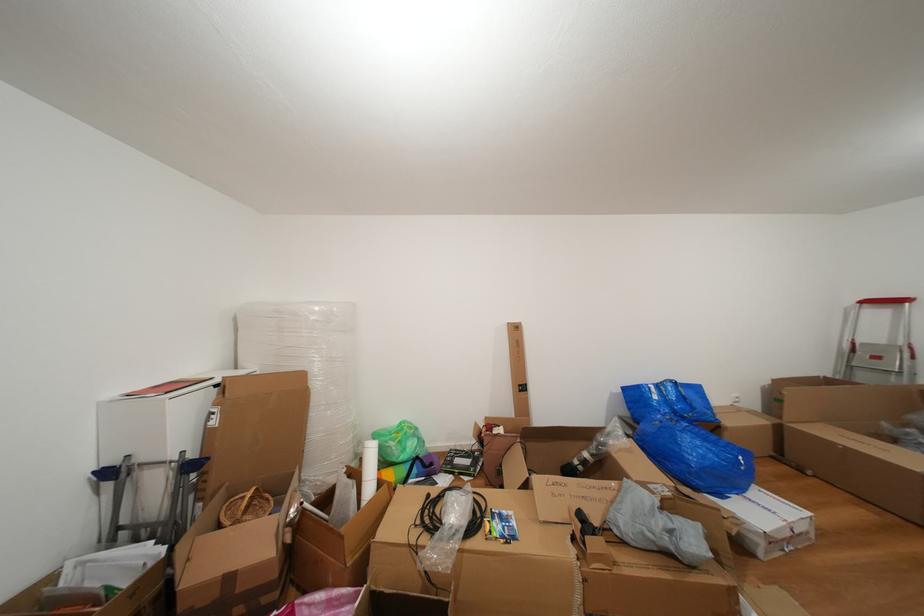
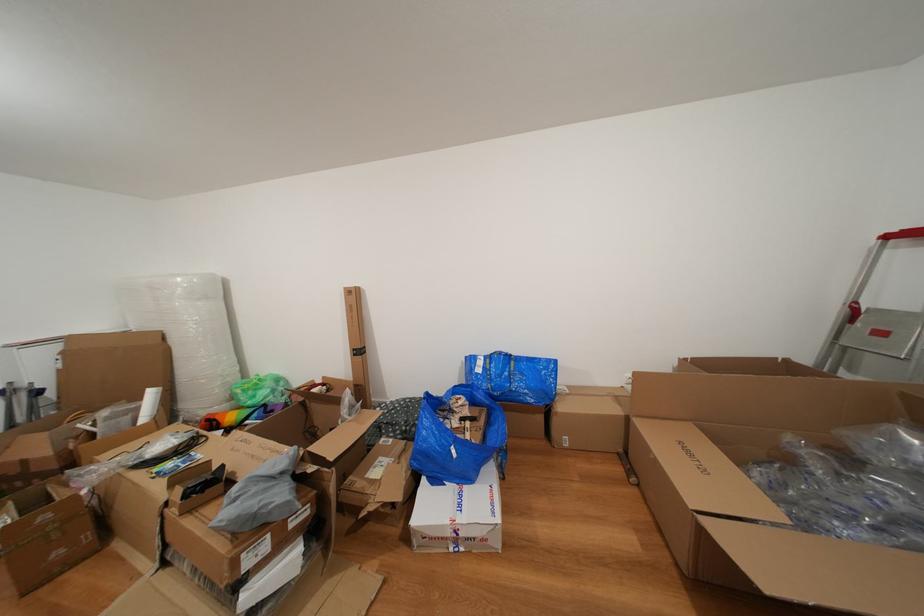
Question: Which direction would the cameraman need to move to produce the second image? Reply with the corresponding letter.

Choices:
 (A) Left
 (B) Right
 (C) Forward
 (D) Backward

Answer: (B)